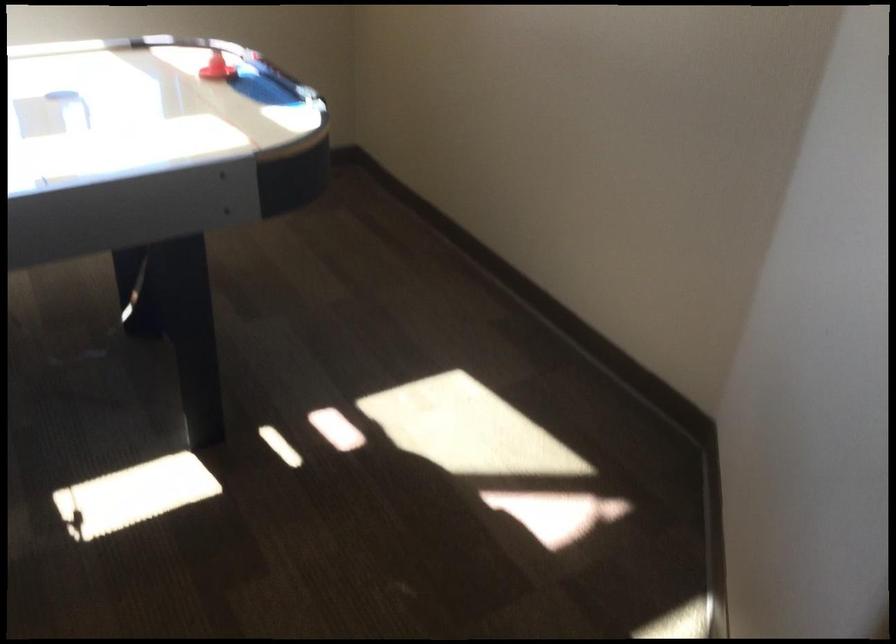
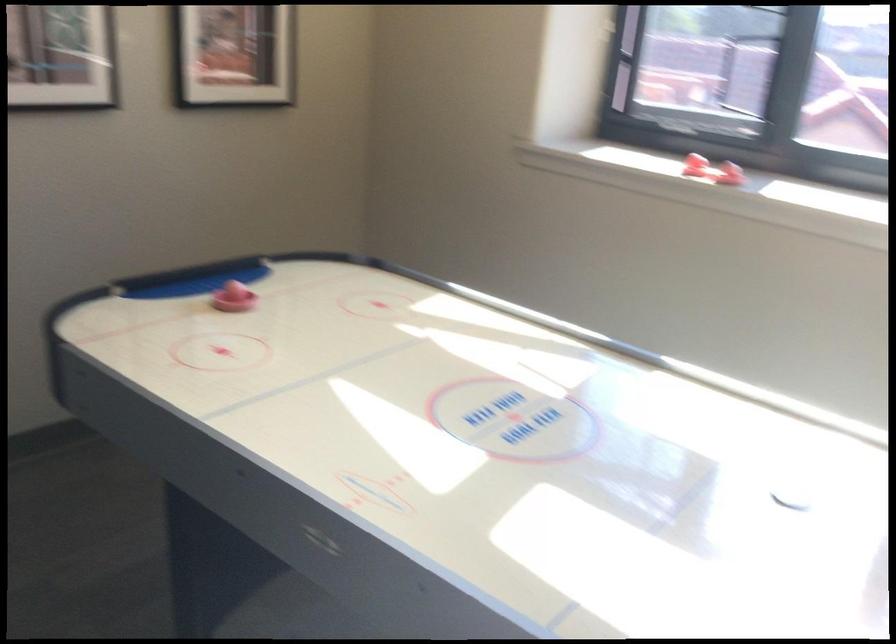
Question: How did the camera likely rotate?

Choices:
 (A) Left
 (B) Right
 (C) Up
 (D) Down

Answer: (A)